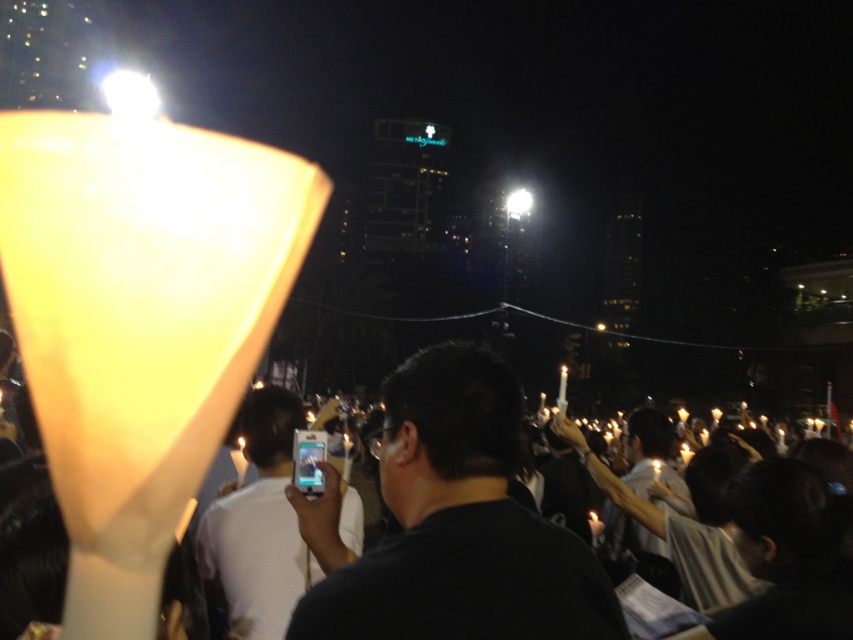
You are standing in the crowd holding a smartphone. The matte white candle at center is positioned at coordinates 0.820 on the x axis and 0.539 on the y axis. If you want to capture the candle in your photo, should you move left or right?

The matte white candle at center is located at point 0.820 on the x axis and 0.539 on the y axis. Since the candle is at the center, you should not need to move left or right to capture it in your photo.

You are a photographer trying to capture the crowd holding candles during a vigil. You have two phones available, the black matte phone at center and the white glossy phone at center. Which phone should you use if you want the camera to be closer to the crowd in the photo?

The black matte phone at center is closer to the viewer than the white glossy phone at center, so using the black matte phone at center would place the camera closer to the crowd.